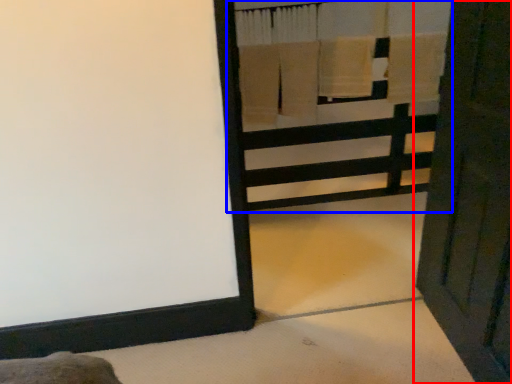
Question: Which point is closer to the camera, door (highlighted by a red box) or bunk bed (highlighted by a blue box)?

Choices:
 (A) door
 (B) bunk bed

Answer: (A)